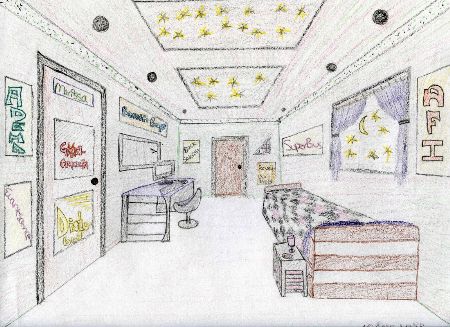
I want to click on chair, so (196, 209).